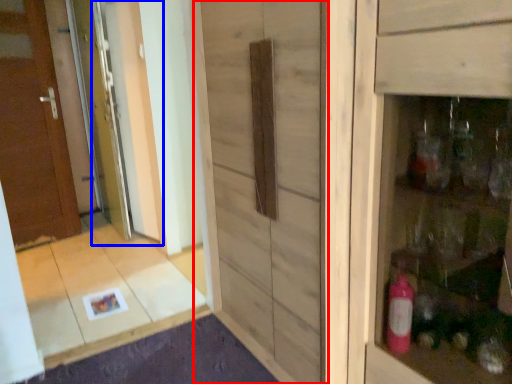
Question: Which of the following is the closest to the observer, barn door (highlighted by a red box) or screen door (highlighted by a blue box)?

Choices:
 (A) barn door
 (B) screen door

Answer: (A)